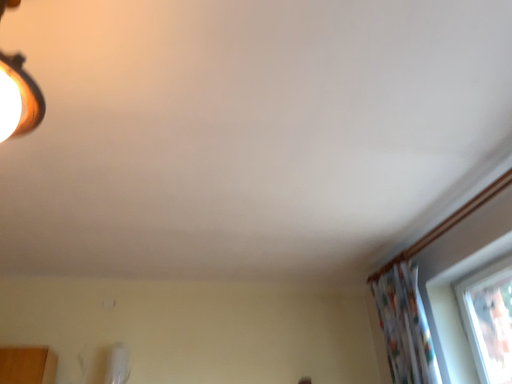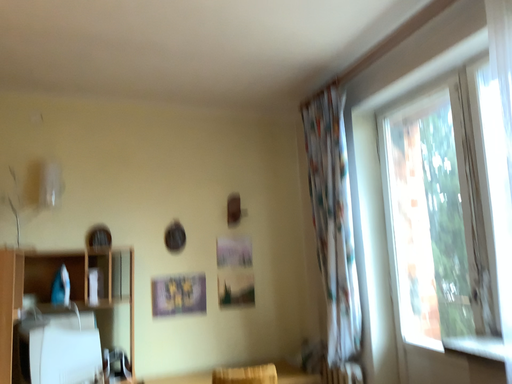
Question: How did the camera likely rotate when shooting the video?

Choices:
 (A) rotated right
 (B) rotated left

Answer: (A)